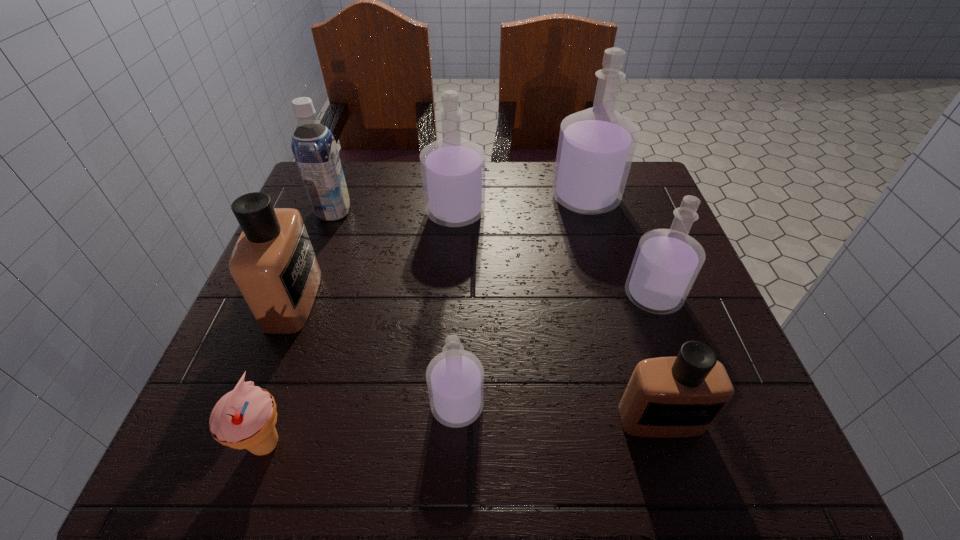
In order to click on soya milk present at the left edge in this screenshot , I will do pyautogui.click(x=314, y=147).

Find the location of a particular element. This screenshot has width=960, height=540. perfume that is at the left edge is located at coordinates (273, 264).

Where is `icecream that is at the left edge`? Image resolution: width=960 pixels, height=540 pixels. icecream that is at the left edge is located at coordinates (244, 418).

Identify the location of object at the far left corner. (314, 147).

Find the location of `object that is at the near left corner`. object that is at the near left corner is located at coordinates (244, 418).

Locate an element on the screen. The height and width of the screenshot is (540, 960). object that is positioned at the far right corner is located at coordinates (596, 146).

I want to click on object that is at the near right corner, so click(666, 397).

Locate an element on the screen. This screenshot has height=540, width=960. vacant area at the far edge is located at coordinates point(389,175).

This screenshot has height=540, width=960. In the image, there is a desktop. In order to click on vacant space at the near edge in this screenshot , I will do click(610, 452).

In the image, there is a desktop. Identify the location of blank space at the left edge. (338, 227).